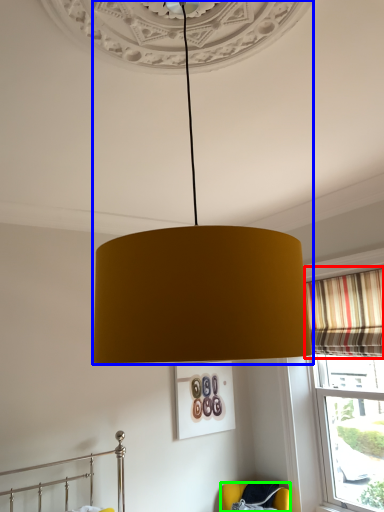
Question: Considering the real-world distances, which object is farthest from curtain (highlighted by a red box)? lamp (highlighted by a blue box) or furniture (highlighted by a green box)?

Choices:
 (A) lamp
 (B) furniture

Answer: (A)